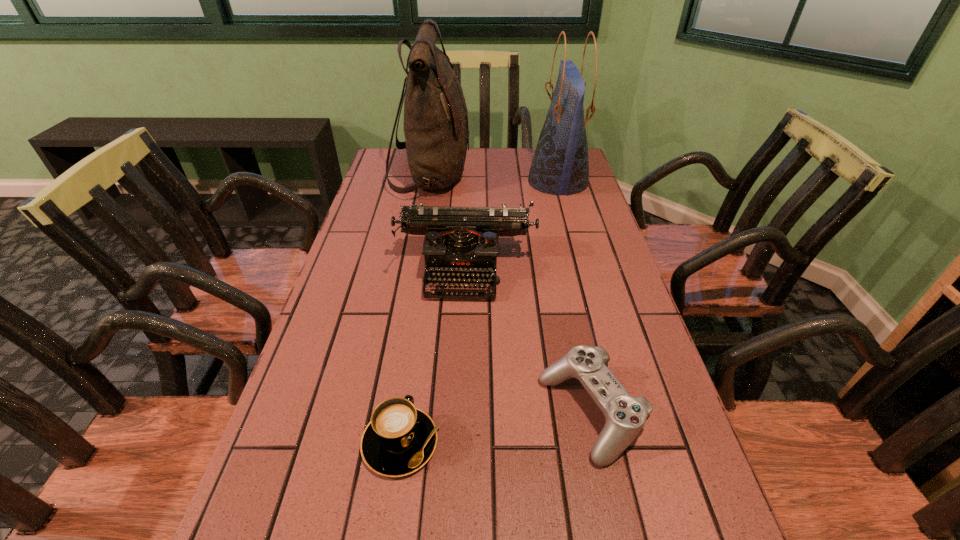
In the image, there is a desktop. Identify the location of vacant space at the far edge. This screenshot has width=960, height=540. (495, 159).

This screenshot has height=540, width=960. Find the location of `vacant space at the left edge`. vacant space at the left edge is located at coordinates (369, 193).

In the image, there is a desktop. At what (x,y) coordinates should I click in order to perform the action: click on blank space at the right edge. Please return your answer as a coordinate pair (x, y). This screenshot has width=960, height=540. Looking at the image, I should click on (566, 279).

Image resolution: width=960 pixels, height=540 pixels. I want to click on vacant space at the far left corner of the desktop, so click(395, 174).

Locate an element on the screen. This screenshot has width=960, height=540. blank region between the control and the typewriter is located at coordinates (528, 341).

I want to click on free spot between the control and the cappuccino, so click(496, 428).

Where is `free point between the control and the cappuccino`? This screenshot has height=540, width=960. free point between the control and the cappuccino is located at coordinates (496, 428).

You are a GUI agent. You are given a task and a screenshot of the screen. Output one action in this format:
    pyautogui.click(x=<x>, y=<y>)
    Task: Click on the empty space that is in between the cappuccino and the typewriter
    The image size is (960, 540).
    Given the screenshot: What is the action you would take?
    pyautogui.click(x=433, y=355)

Where is `free space between the cappuccino and the backpack`? The width and height of the screenshot is (960, 540). free space between the cappuccino and the backpack is located at coordinates (417, 308).

The height and width of the screenshot is (540, 960). Identify the location of object that is the fourth nearest to the shopping bag. (400, 439).